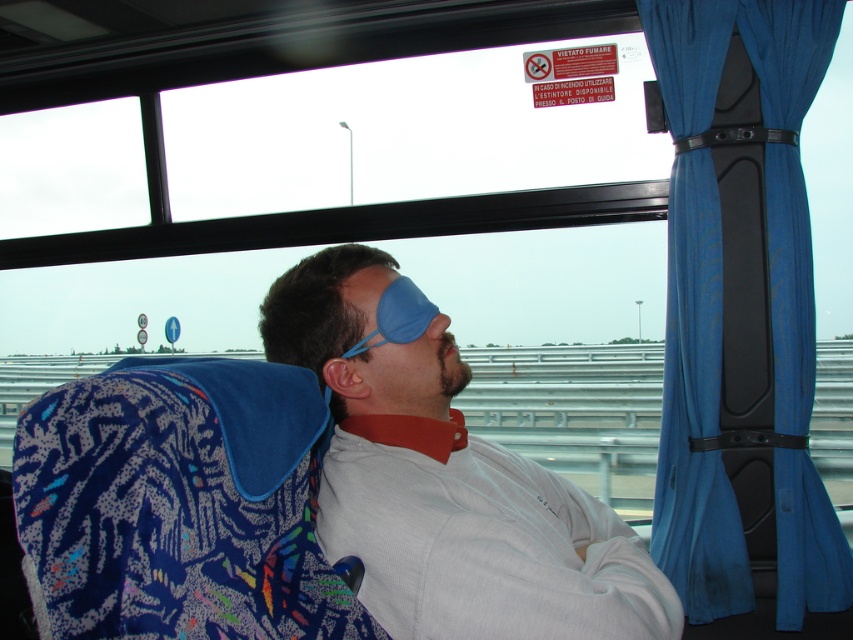
You are a passenger on the bus and want to check the view outside through the window. However, you notice the blue matte eye mask at center and the blue fabric curtain at right. Which object is closer to you that might block your view?

The blue matte eye mask at center is closer to the viewer than the blue fabric curtain at right, so it might block your view.